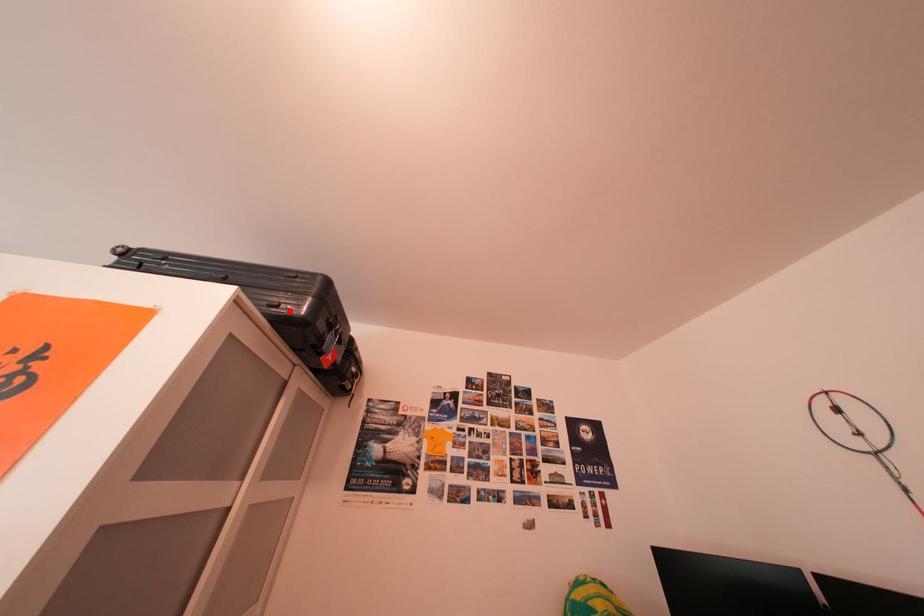
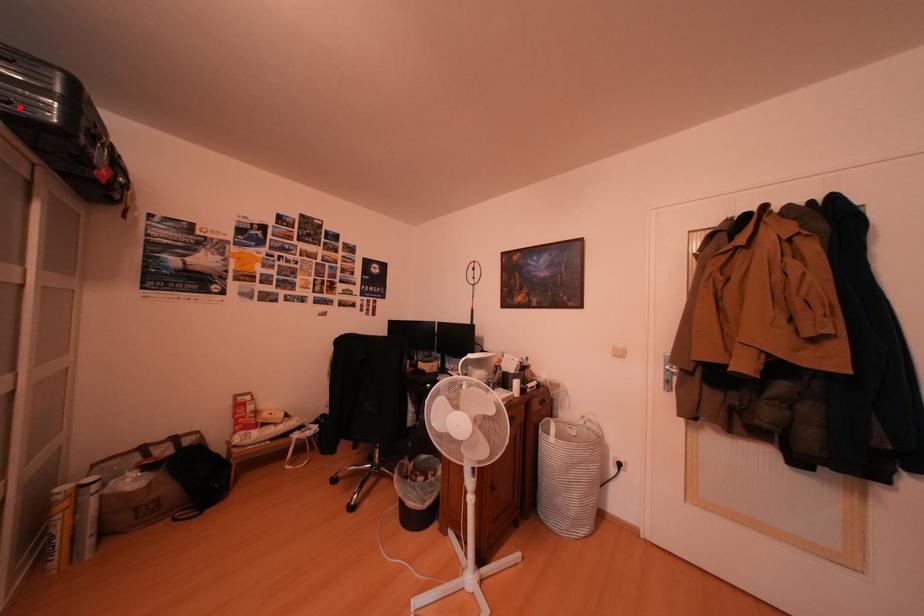
I am providing you with two images of the same scene from different viewpoints. A red point is marked on the first image and another point is marked on the second image. Is the marked point in image1 the same physical position as the marked point in image2?

Yes